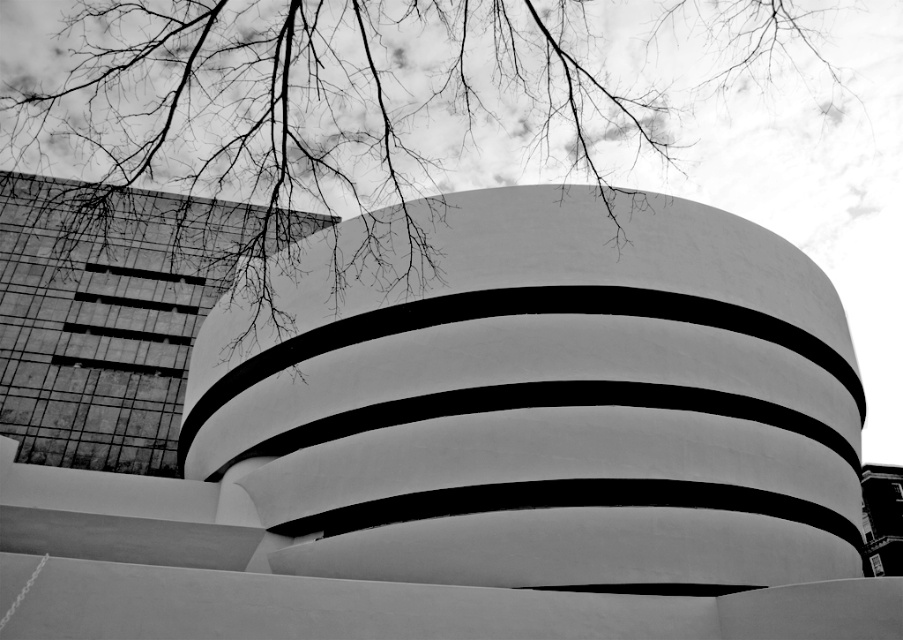
Looking at the image of the architectural structure, where is the white smooth building at center in relation to the bare branches at upper center?

The white smooth building at center is located to the left of the bare branches at upper center.

You are standing at the origin point of the coordinate system. You want to locate the white smooth building at center. Which direction should you move in the coordinate system to reach it?

Result: You should move towards the point with x coordinate greater than 0.692 and y coordinate greater than 0.527 to reach the white smooth building at center.

You are standing at the point marked as point (475,442) in the image. What object is directly in front of you?

The white smooth building at center is directly in front of you at point (475,442).